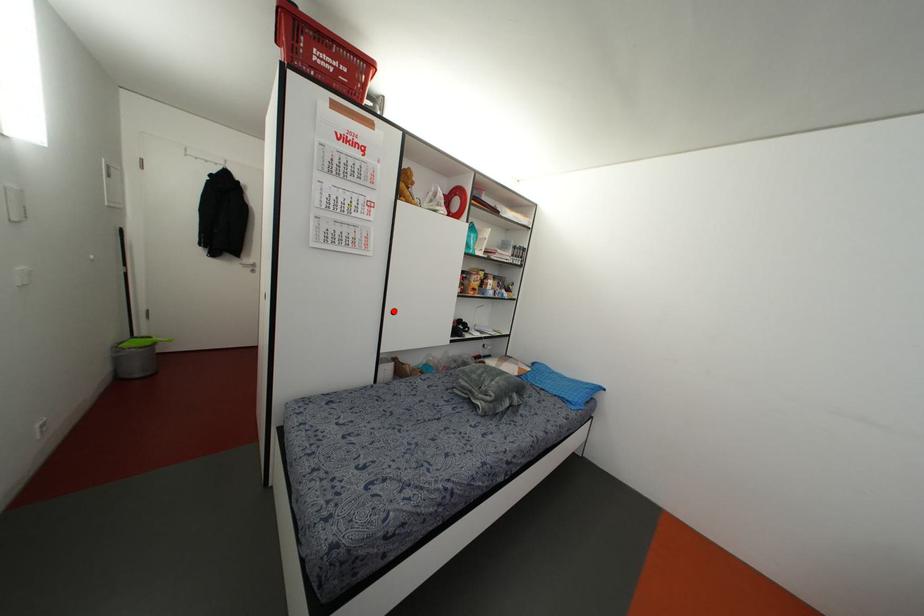
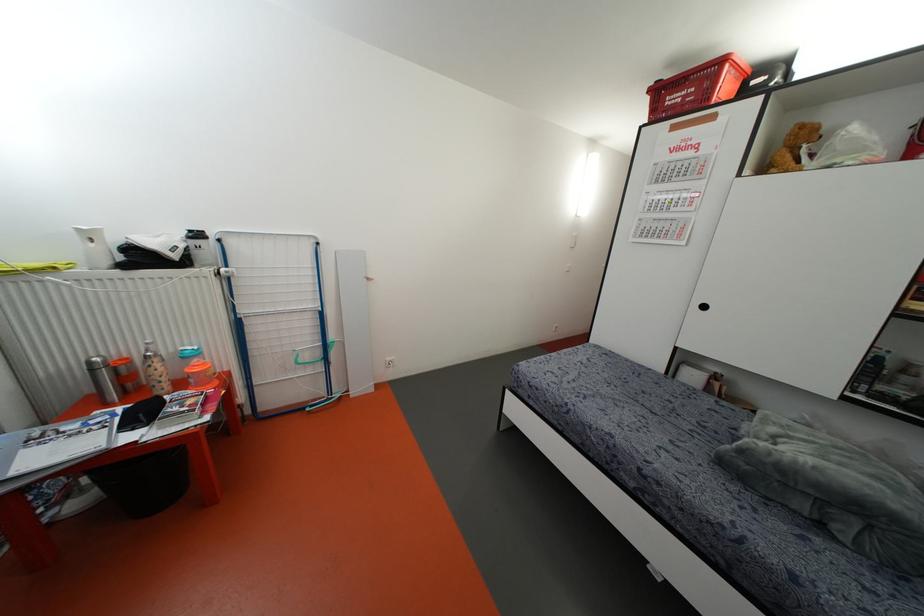
Where in the second image is the point corresponding to the highlighted location from the first image?

(703, 307)